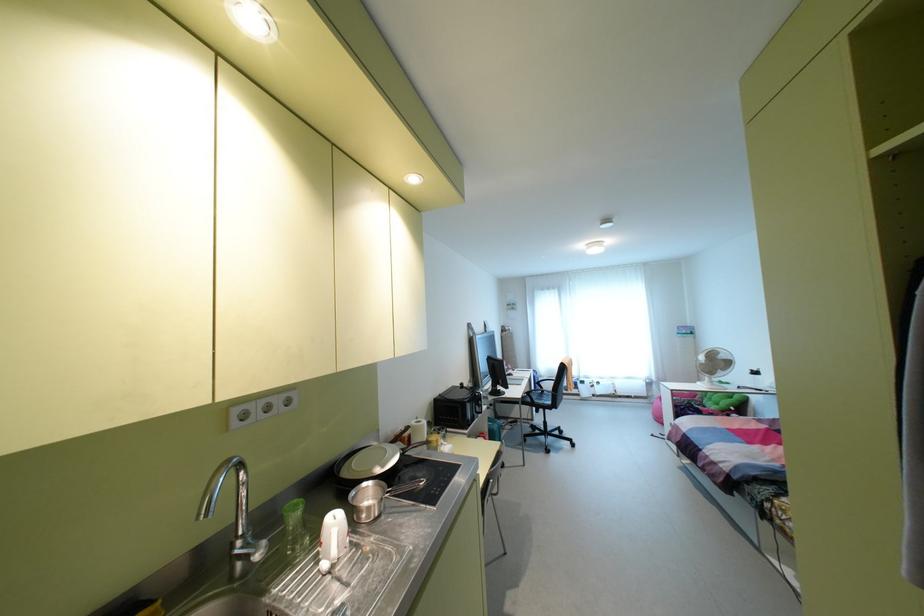
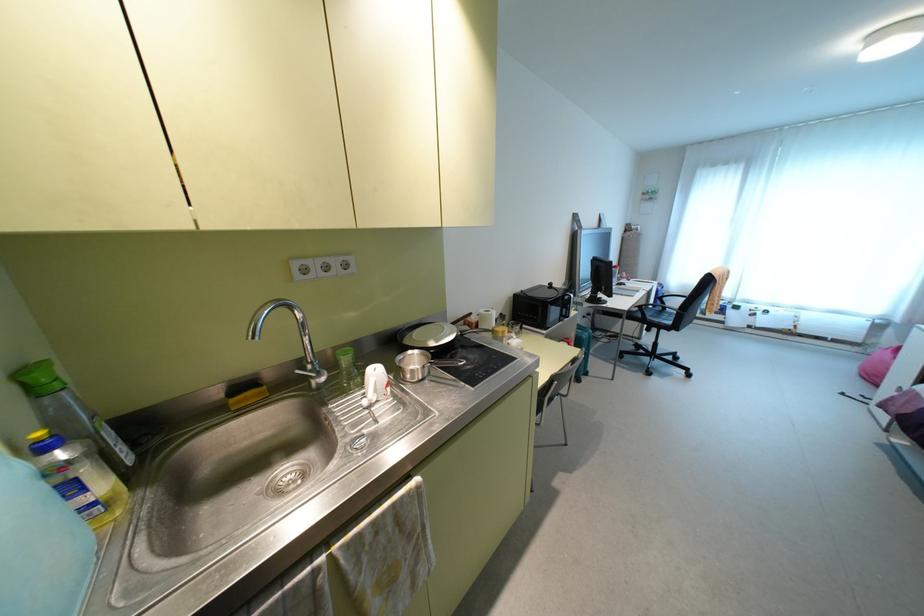
Find the pixel in the second image that matches (548,386) in the first image.

(674, 302)